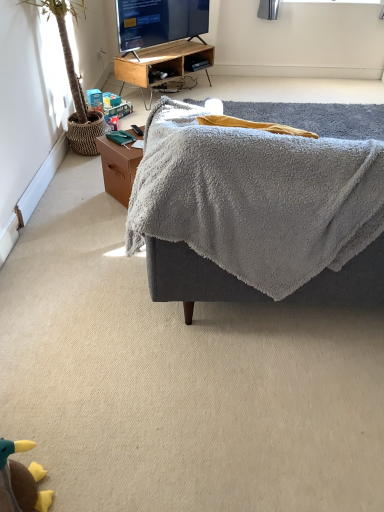
At what (x,y) coordinates should I click in order to perform the action: click on free space between green leafy plant at left and plush yellow duck at lower left. Please return your answer as a coordinate pair (x, y). Looking at the image, I should click on (72, 271).